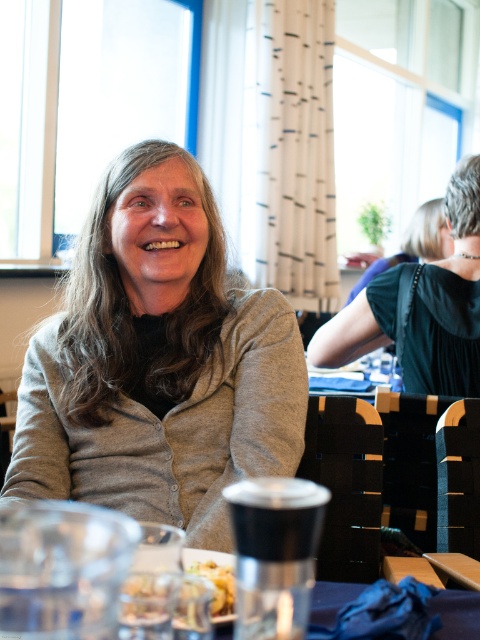
Can you confirm if gray matte cardigan at center is taller than dark green dress at center?

Yes.

Does gray matte cardigan at center come in front of dark green dress at center?

Yes, it is.

Between point (252, 436) and point (340, 337), which one is positioned in front?

Point (252, 436)

This screenshot has width=480, height=640. Find the location of `gray matte cardigan at center`. gray matte cardigan at center is located at coordinates (157, 364).

Is translucent glass plate at center in front of golden crumbly pastry at lower center?

Yes, it is.

Is point (210, 561) positioned in front of point (227, 604)?

No, it is behind (227, 604).

Does point (220, 564) come farther from viewer compared to point (223, 589)?

Yes, point (220, 564) is behind point (223, 589).

This screenshot has height=640, width=480. In order to click on translucent glass plate at center in this screenshot , I will do `click(216, 579)`.

Is gray matte cardigan at center thinner than translucent glass plate at center?

No, gray matte cardigan at center is not thinner than translucent glass plate at center.

Where is `gray matte cardigan at center`? This screenshot has width=480, height=640. gray matte cardigan at center is located at coordinates (157, 364).